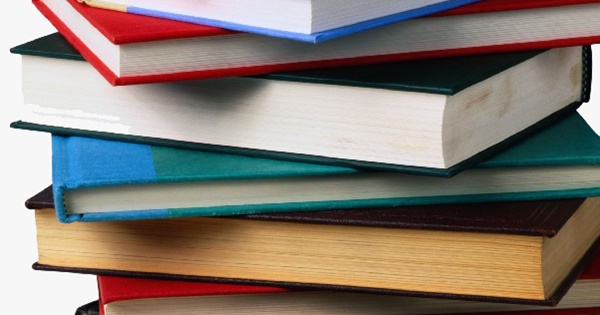
Where is `books visible and partly visible`? The width and height of the screenshot is (600, 315). books visible and partly visible is located at coordinates coord(243,302), coord(351,263), coord(244,199), coord(335,129), coord(171,50), coord(312,13).